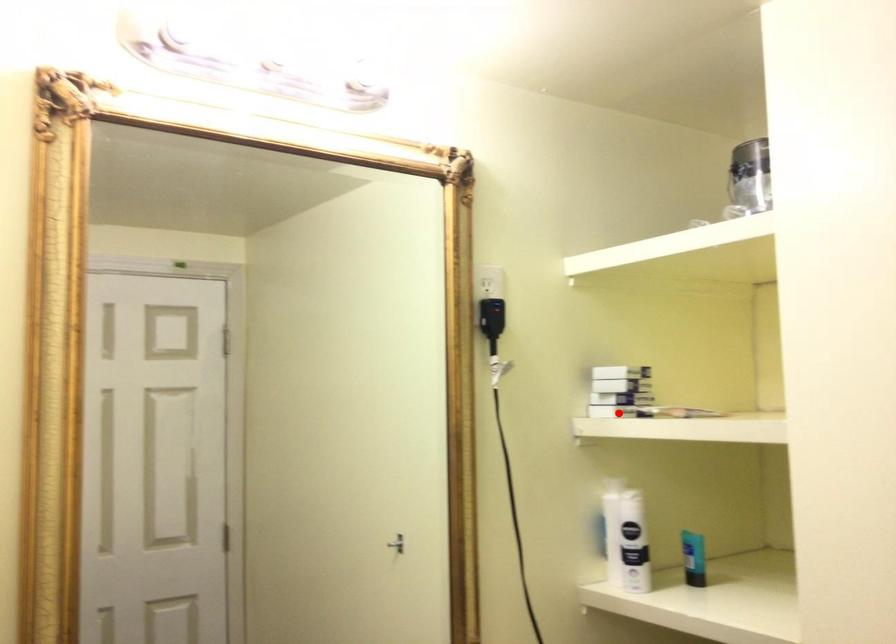
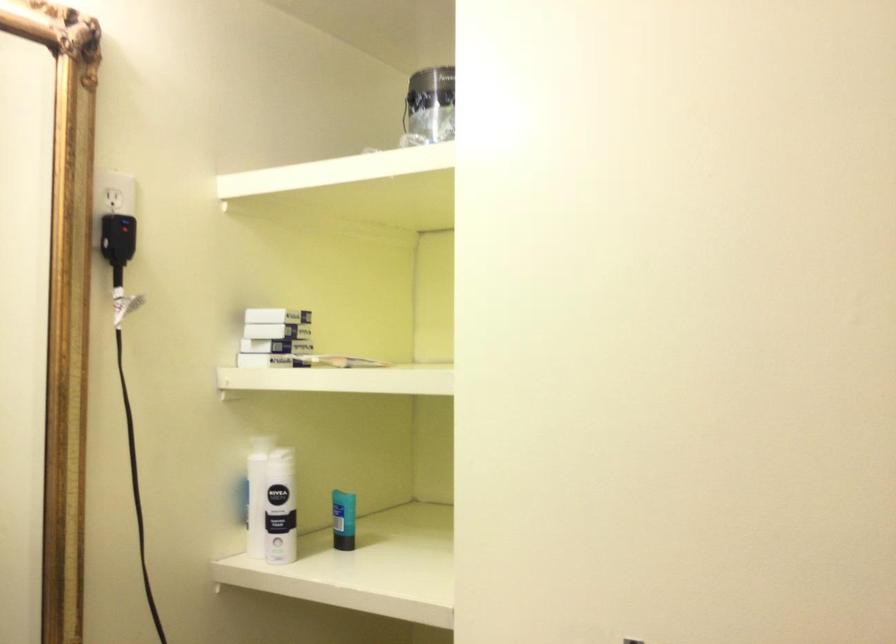
Question: I am providing you with two images of the same scene from different viewpoints. Image1 has a red point marked. In image2, the corresponding 3D location appears at what relative position? Reply with the corresponding letter.

Choices:
 (A) Closer
 (B) Farther

Answer: (A)